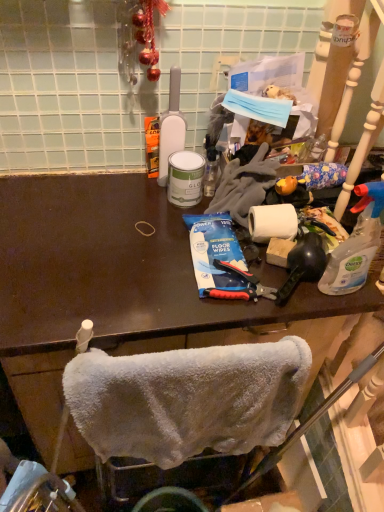
You are a GUI agent. You are given a task and a screenshot of the screen. Output one action in this format:
    pyautogui.click(x=<x>, y=<y>)
    Task: Click on the free spot above white fluffy towel at lower center (from a real-world perspective)
    
    Given the screenshot: What is the action you would take?
    pyautogui.click(x=194, y=358)